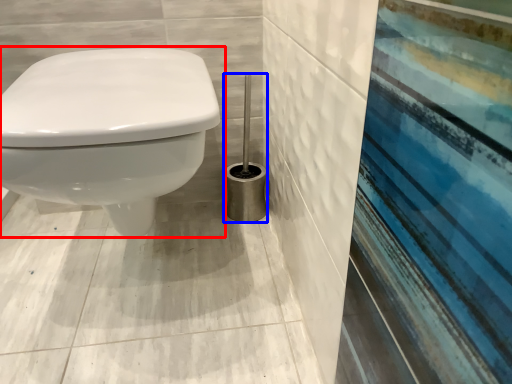
Question: Among these objects, which one is nearest to the camera, toilet (highlighted by a red box) or brush (highlighted by a blue box)?

Choices:
 (A) toilet
 (B) brush

Answer: (A)